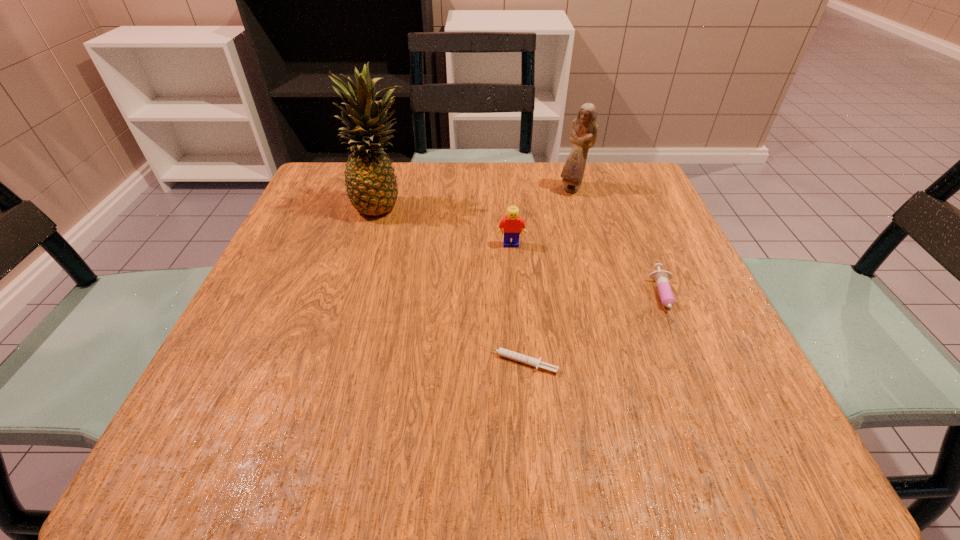
Image resolution: width=960 pixels, height=540 pixels. Identify the location of the leftmost object. pyautogui.click(x=371, y=186).

This screenshot has width=960, height=540. I want to click on pineapple, so click(x=371, y=186).

Find the location of `the fourth shortest object`. the fourth shortest object is located at coordinates (583, 134).

The height and width of the screenshot is (540, 960). I want to click on the fourth object from left to right, so click(x=583, y=134).

At what (x,y) coordinates should I click in order to perform the action: click on Lego. Please return your answer as a coordinate pair (x, y). Looking at the image, I should click on (512, 225).

Where is `the third nearest object`? The width and height of the screenshot is (960, 540). the third nearest object is located at coordinates (512, 225).

Find the location of a particular element. This screenshot has height=540, width=960. the rightmost object is located at coordinates (661, 277).

You are a GUI agent. You are given a task and a screenshot of the screen. Output one action in this format:
    pyautogui.click(x=<x>, y=<y>)
    Task: Click on the farther syringe
    The height and width of the screenshot is (540, 960).
    Given the screenshot: What is the action you would take?
    pyautogui.click(x=661, y=277)

Where is `the nearest object`? This screenshot has width=960, height=540. the nearest object is located at coordinates (531, 361).

Where is `the nearer syringe`? the nearer syringe is located at coordinates (531, 361).